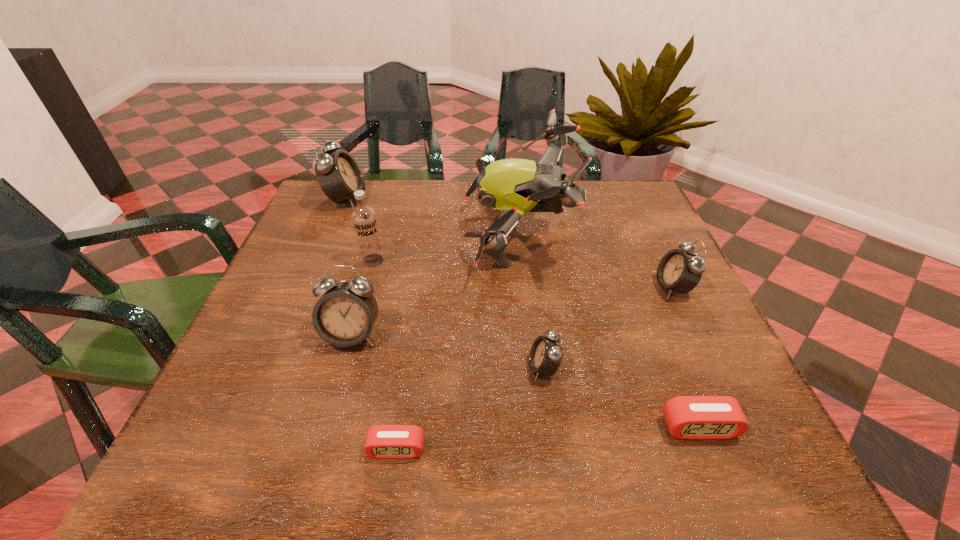
What are the coordinates of `drone` in the screenshot? It's located at (514, 187).

The image size is (960, 540). I want to click on green drone, so pyautogui.click(x=514, y=187).

Locate an element on the screen. This screenshot has height=540, width=960. vodka is located at coordinates (364, 219).

The image size is (960, 540). I want to click on the farthest white alarm clock, so (x=338, y=174).

Where is `the leftmost alarm clock`? the leftmost alarm clock is located at coordinates (338, 174).

Where is `the fifth shortest alarm clock`? This screenshot has height=540, width=960. the fifth shortest alarm clock is located at coordinates (344, 315).

At what (x,y) coordinates should I click in order to perform the action: click on the third white alarm clock from right to left. Please return your answer as a coordinate pair (x, y). Looking at the image, I should click on (344, 315).

The image size is (960, 540). Identify the location of the fifth tallest object. (680, 271).

Where is `the rightmost white alarm clock`? the rightmost white alarm clock is located at coordinates (680, 271).

At what (x,y) coordinates should I click in order to perform the action: click on the fourth alarm clock from left to right. Please return your answer as a coordinate pair (x, y). Looking at the image, I should click on (546, 353).